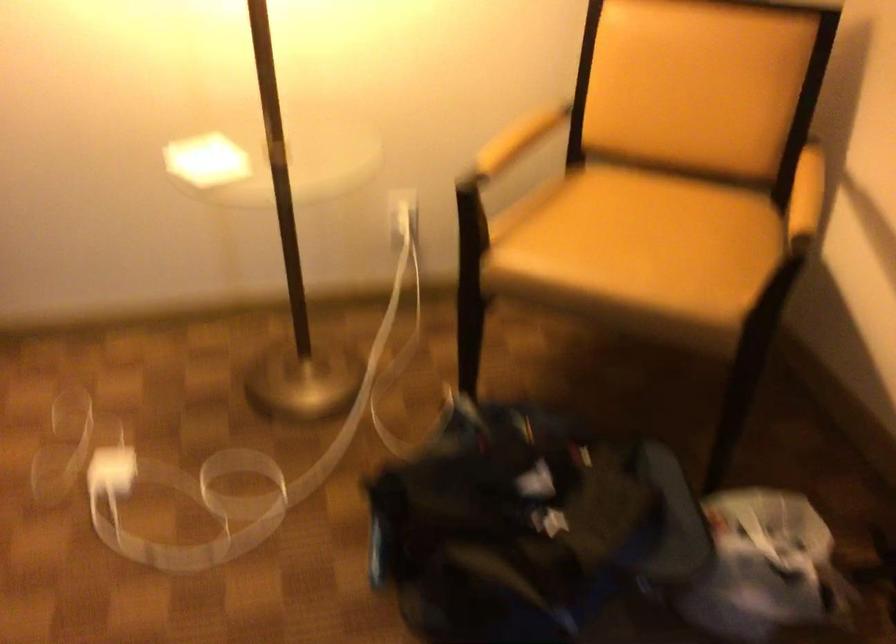
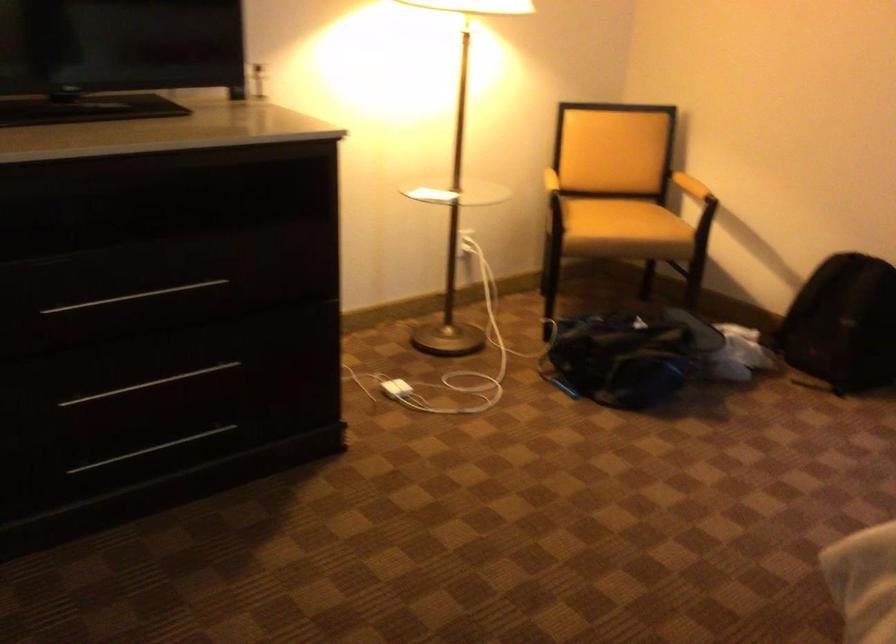
Which direction would the cameraman need to move to produce the second image?

The cameraman moved toward left, backward.